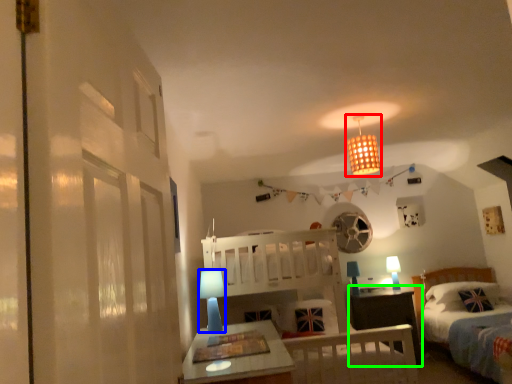
Question: Based on their relative distances, which object is farther from light fixture (highlighted by a red box)? Choose from table lamp (highlighted by a blue box) and nightstand (highlighted by a green box).

Choices:
 (A) table lamp
 (B) nightstand

Answer: (B)